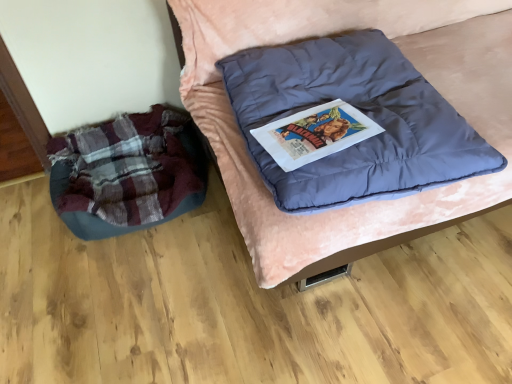
Question: From a real-world perspective, is plaid fabric bean bag at left on top of matte blue cushion at center?

Choices:
 (A) yes
 (B) no

Answer: (B)

Question: Is plaid fabric bean bag at left not inside matte blue cushion at center?

Choices:
 (A) yes
 (B) no

Answer: (A)

Question: Does plaid fabric bean bag at left lie in front of matte blue cushion at center?

Choices:
 (A) yes
 (B) no

Answer: (B)

Question: From the image's perspective, is plaid fabric bean bag at left under matte blue cushion at center?

Choices:
 (A) no
 (B) yes

Answer: (B)

Question: Is plaid fabric bean bag at left positioned behind matte blue cushion at center?

Choices:
 (A) no
 (B) yes

Answer: (B)

Question: Is plaid fabric bean bag at left at the left side of matte blue cushion at center?

Choices:
 (A) no
 (B) yes

Answer: (B)

Question: Is matte blue cushion at center turned away from plaid fabric bean bag at left?

Choices:
 (A) no
 (B) yes

Answer: (A)

Question: Is matte blue cushion at center at the right side of plaid fabric bean bag at left?

Choices:
 (A) yes
 (B) no

Answer: (A)

Question: Is matte blue cushion at center thinner than plaid fabric bean bag at left?

Choices:
 (A) yes
 (B) no

Answer: (B)

Question: Considering the relative sizes of matte blue cushion at center and plaid fabric bean bag at left in the image provided, is matte blue cushion at center smaller than plaid fabric bean bag at left?

Choices:
 (A) no
 (B) yes

Answer: (A)

Question: Is matte blue cushion at center outside plaid fabric bean bag at left?

Choices:
 (A) yes
 (B) no

Answer: (A)

Question: Is matte blue cushion at center bigger than plaid fabric bean bag at left?

Choices:
 (A) no
 (B) yes

Answer: (B)

Question: Is plaid fabric bean bag at left inside the boundaries of matte blue cushion at center, or outside?

Choices:
 (A) outside
 (B) inside

Answer: (A)